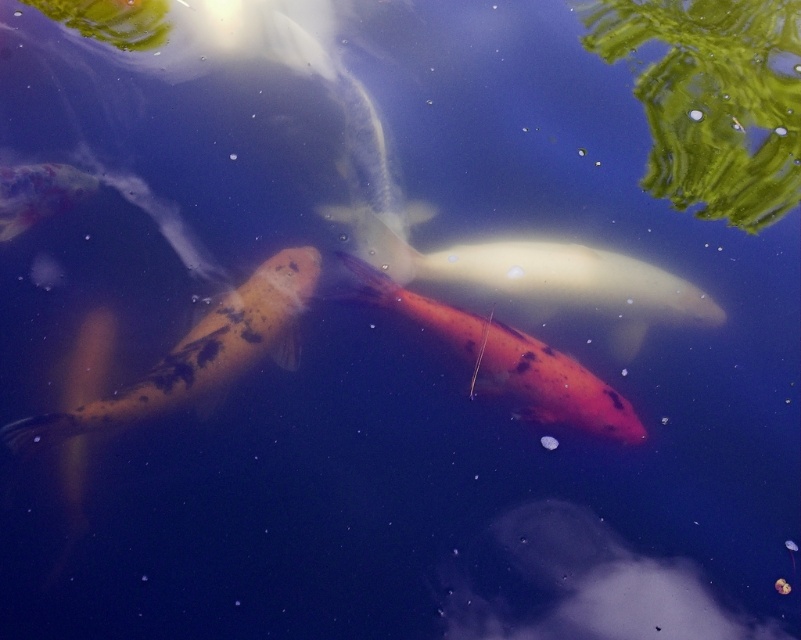
Is speckled orange goldfish at center taller than orange matte goldfish at center?

Yes.

Which of these two, speckled orange goldfish at center or orange matte goldfish at center, stands shorter?

Standing shorter between the two is orange matte goldfish at center.

Does point (131, 406) come farther from viewer compared to point (361, 285)?

No, it is in front of (361, 285).

I want to click on speckled orange goldfish at center, so click(x=198, y=355).